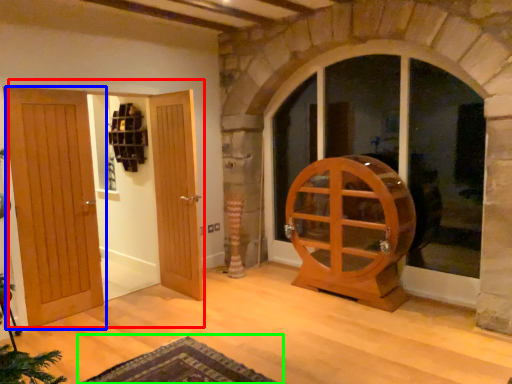
Question: Considering the real-world distances, which object is closest to door (highlighted by a red box)? door (highlighted by a blue box) or doormat (highlighted by a green box).

Choices:
 (A) door
 (B) doormat

Answer: (A)